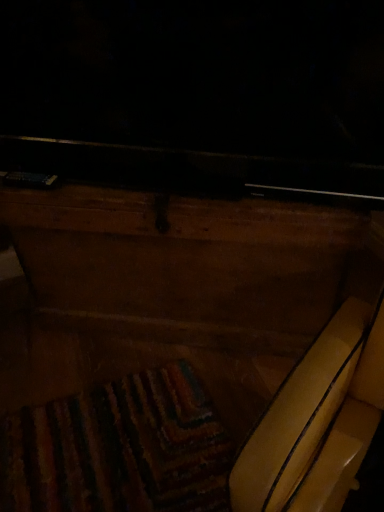
Question: Are wooden chest at center and yellow leather swivel chair at center making contact?

Choices:
 (A) no
 (B) yes

Answer: (A)

Question: Is wooden chest at center aimed at yellow leather swivel chair at center?

Choices:
 (A) yes
 (B) no

Answer: (B)

Question: Can you confirm if wooden chest at center is taller than yellow leather swivel chair at center?

Choices:
 (A) yes
 (B) no

Answer: (B)

Question: Does wooden chest at center have a smaller size compared to yellow leather swivel chair at center?

Choices:
 (A) yes
 (B) no

Answer: (A)

Question: Is wooden chest at center turned away from yellow leather swivel chair at center?

Choices:
 (A) yes
 (B) no

Answer: (B)

Question: Is wooden chest at center thinner than yellow leather swivel chair at center?

Choices:
 (A) yes
 (B) no

Answer: (B)

Question: Is yellow leather swivel chair at center aimed at wooden chest at center?

Choices:
 (A) no
 (B) yes

Answer: (A)

Question: From a real-world perspective, is yellow leather swivel chair at center beneath wooden chest at center?

Choices:
 (A) yes
 (B) no

Answer: (B)

Question: From a real-world perspective, is yellow leather swivel chair at center physically above wooden chest at center?

Choices:
 (A) yes
 (B) no

Answer: (A)

Question: Is yellow leather swivel chair at center to the left of wooden chest at center from the viewer's perspective?

Choices:
 (A) yes
 (B) no

Answer: (B)

Question: Does yellow leather swivel chair at center come behind wooden chest at center?

Choices:
 (A) no
 (B) yes

Answer: (A)

Question: Would you say yellow leather swivel chair at center is a long distance from wooden chest at center?

Choices:
 (A) yes
 (B) no

Answer: (B)

Question: In terms of height, does yellow leather swivel chair at center look taller or shorter compared to wooden chest at center?

Choices:
 (A) tall
 (B) short

Answer: (A)